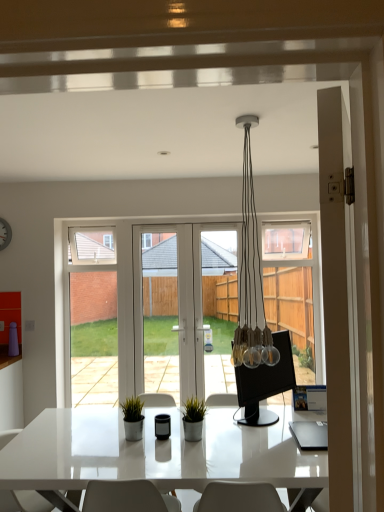
Image resolution: width=384 pixels, height=512 pixels. Identify the location of free space to the right of green matte plant at center. (222, 437).